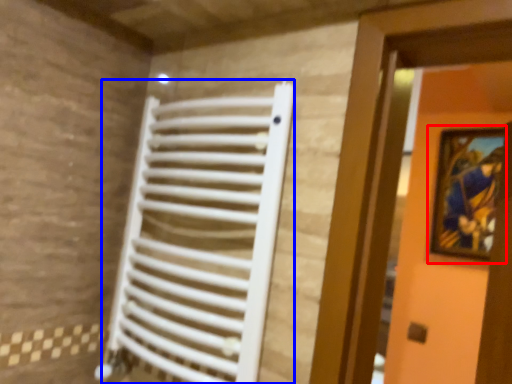
Question: Which object is closer to the camera taking this photo, picture frame (highlighted by a red box) or radiator (highlighted by a blue box)?

Choices:
 (A) picture frame
 (B) radiator

Answer: (B)